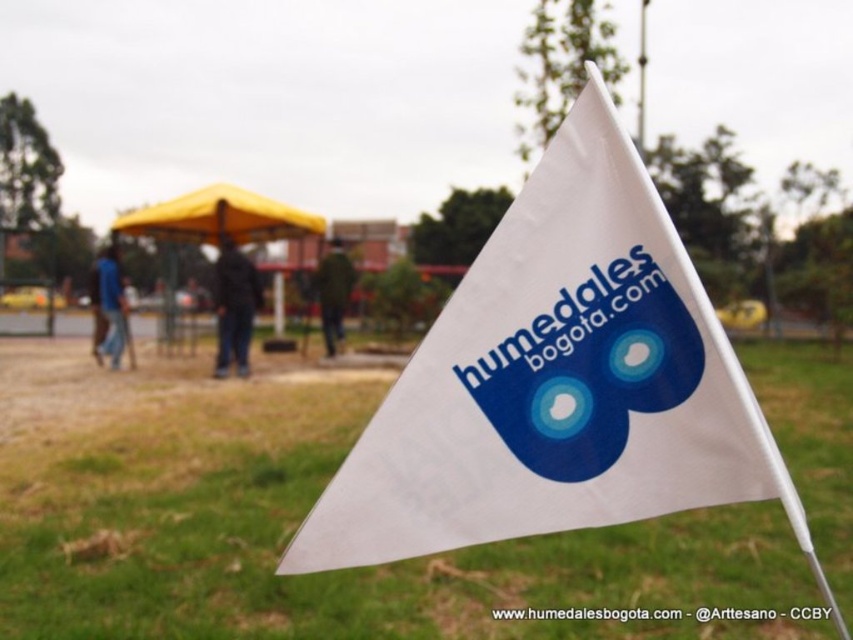
You are standing at the edge of the dirt area near the yellow canopy tent. You want to place a 3 meter long ladder between the green grass at center and the white fabric flag at center. Is there enough space between them to fit the ladder horizontally?

The green grass at center is 2.87 meters away from the white fabric flag at center. Since the ladder is 3 meters long, there isn t enough space to fit it horizontally between them.

Based on the scene description, can you determine if the green grass at center is wider than the white plastic pole at upper center?

The green grass at center might be wider than white plastic pole at upper center.